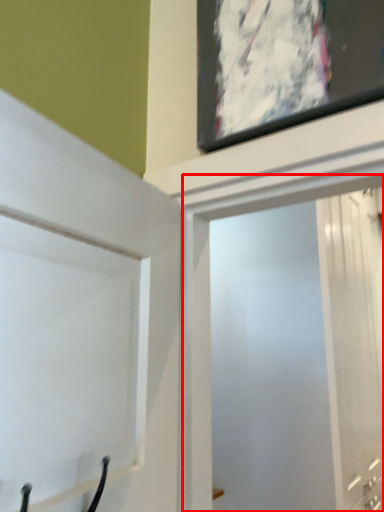
Question: Where is screen door (annotated by the red box) located in relation to door in the image?

Choices:
 (A) right
 (B) left

Answer: (A)